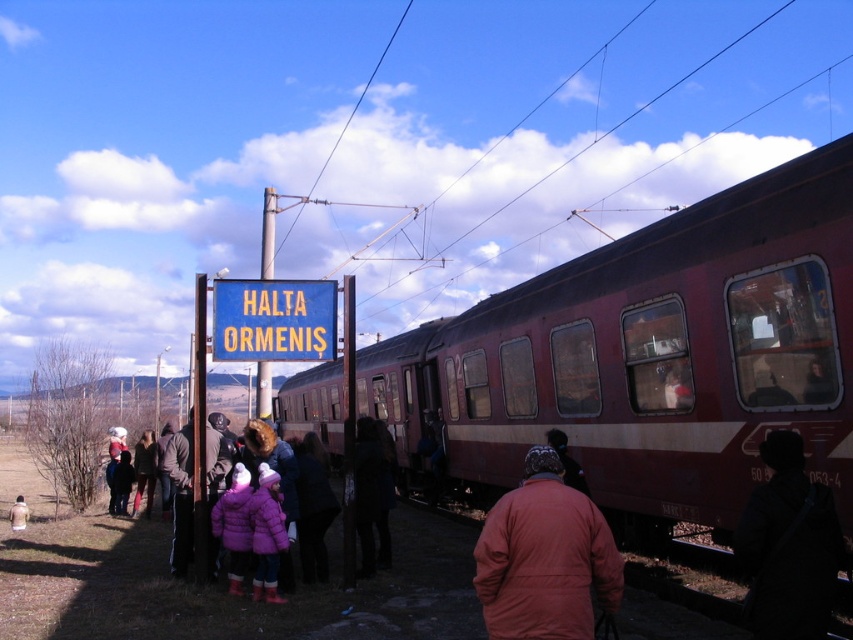
From the picture: Based on the coordinates provided, what object is located at point (651, 358) in the image?

The point (651, 358) marks the maroon metallic train at center.